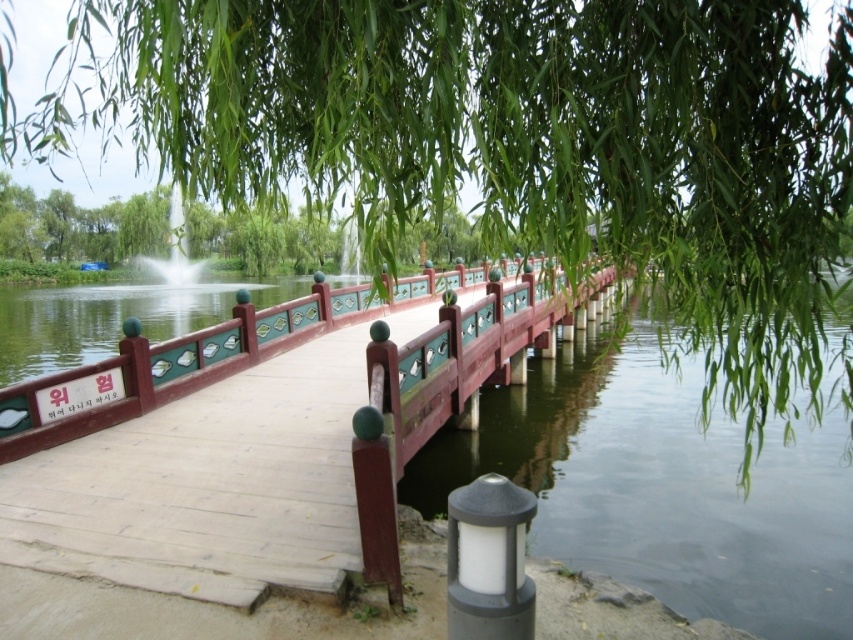
Question: Can you confirm if wooden dock at center is thinner than matte gray lamp post at lower center?

Choices:
 (A) no
 (B) yes

Answer: (A)

Question: Which object is closer to the camera taking this photo?

Choices:
 (A) matte gray lamp post at lower center
 (B) polished wood railing at center
 (C) wooden dock at center

Answer: (A)

Question: Which point is closer to the camera taking this photo?

Choices:
 (A) (305, 344)
 (B) (463, 259)
 (C) (511, 372)
 (D) (468, 579)

Answer: (D)

Question: Does wooden dock at center appear on the left side of matte gray lamp post at lower center?

Choices:
 (A) yes
 (B) no

Answer: (B)

Question: Among these points, which one is nearest to the camera?

Choices:
 (A) (30, 244)
 (B) (312, 477)
 (C) (521, 580)
 (D) (474, 326)

Answer: (C)

Question: Does green leafy tree at upper center have a lesser width compared to matte gray lamp post at lower center?

Choices:
 (A) no
 (B) yes

Answer: (A)